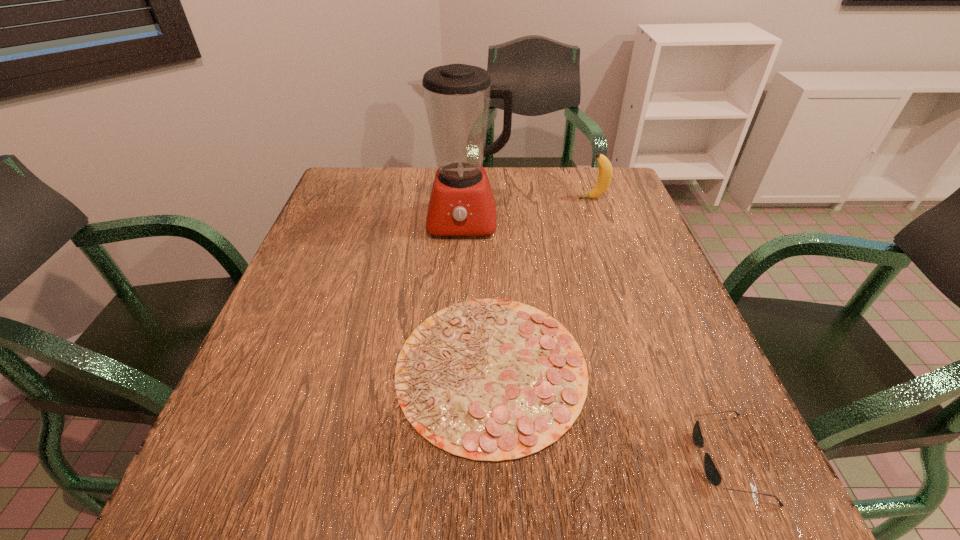
The width and height of the screenshot is (960, 540). In order to click on vacant region between the sunglasses and the banana in this screenshot , I will do click(x=660, y=328).

Image resolution: width=960 pixels, height=540 pixels. Find the location of `blank region between the pizza and the tallest object`. blank region between the pizza and the tallest object is located at coordinates (476, 294).

In order to click on vacant region between the banana and the pizza in this screenshot , I will do `click(541, 284)`.

Locate an element on the screen. empty location between the third nearest object and the pizza is located at coordinates (476, 294).

Locate an element on the screen. Image resolution: width=960 pixels, height=540 pixels. free space between the sunglasses and the second tallest object is located at coordinates (660, 328).

Find the location of `free point between the sunglasses and the second farthest object`. free point between the sunglasses and the second farthest object is located at coordinates (596, 340).

Where is `empty space that is in between the second tallest object and the sunglasses`? The image size is (960, 540). empty space that is in between the second tallest object and the sunglasses is located at coordinates (660, 328).

Choose which object is the third nearest neighbor to the banana. Please provide its 2D coordinates. Your answer should be formatted as a tuple, i.e. [(x, y)], where the tuple contains the x and y coordinates of a point satisfying the conditions above.

[(711, 471)]

Locate which object is the third closest to the sunglasses. Please provide its 2D coordinates. Your answer should be formatted as a tuple, i.e. [(x, y)], where the tuple contains the x and y coordinates of a point satisfying the conditions above.

[(605, 168)]

I want to click on vacant space that satisfies the following two spatial constraints: 1. from the stem of the third shortest object; 2. on the front of the tallest object near the controls, so click(601, 221).